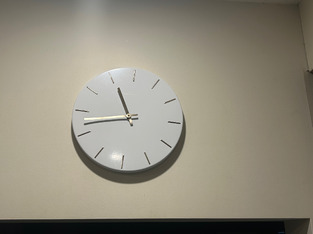
The height and width of the screenshot is (234, 313). I want to click on clock, so click(121, 128).